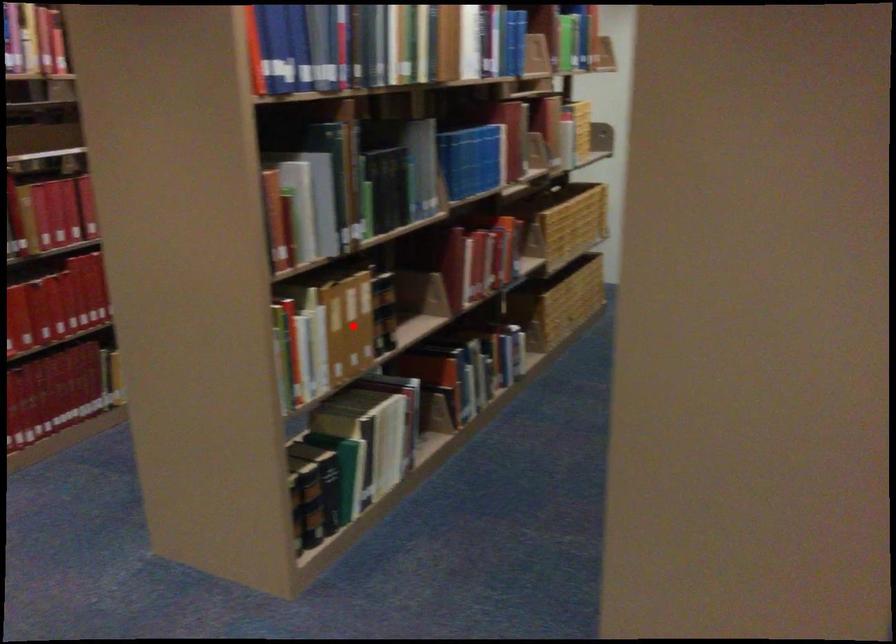
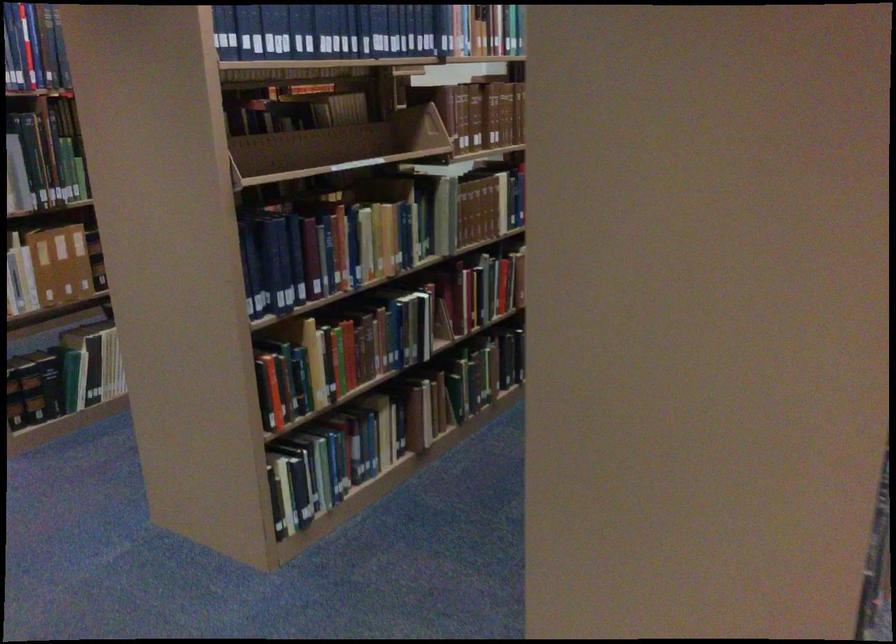
Find the pixel in the second image that matches the highlighted location in the first image.

(61, 263)